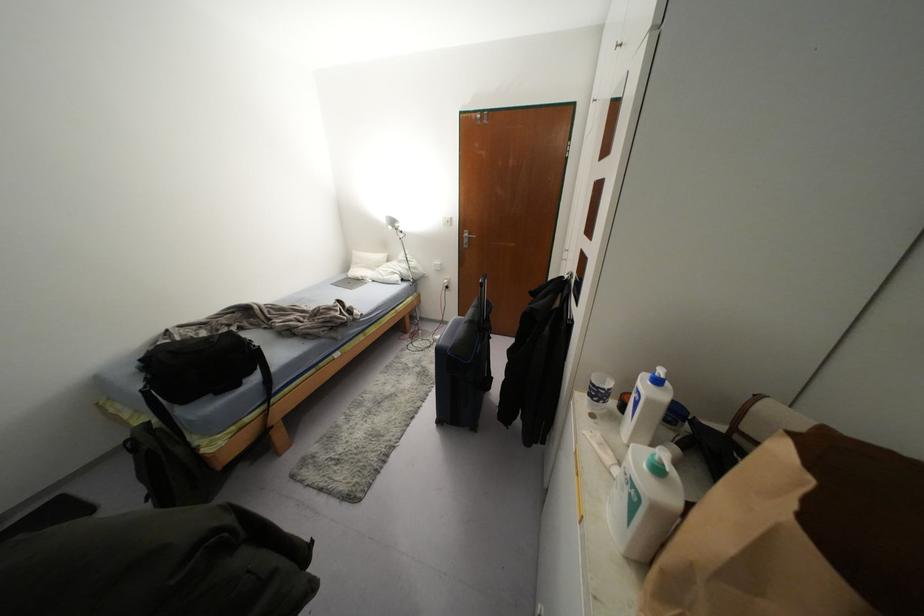
The height and width of the screenshot is (616, 924). What are the coordinates of `silver door handle` in the screenshot? It's located at (467, 235).